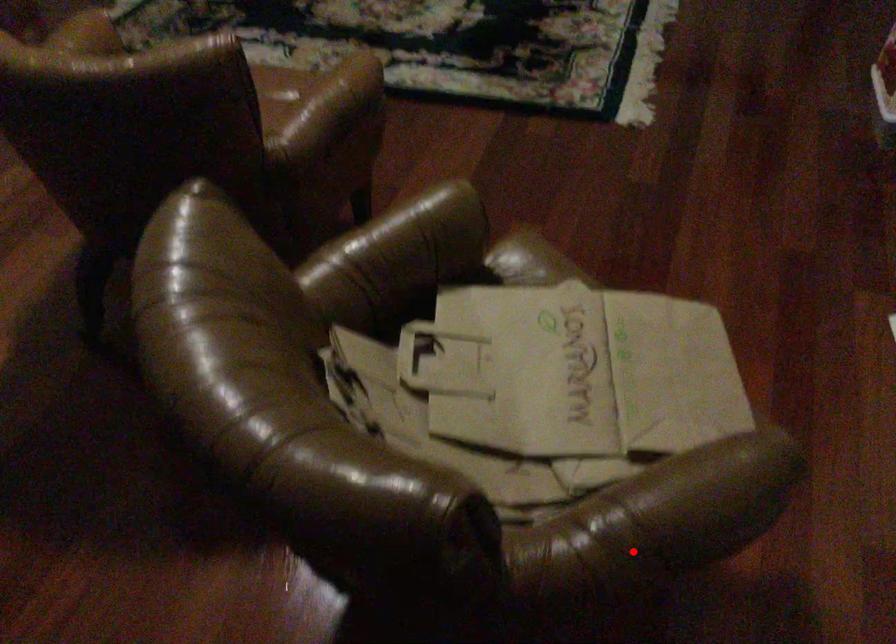
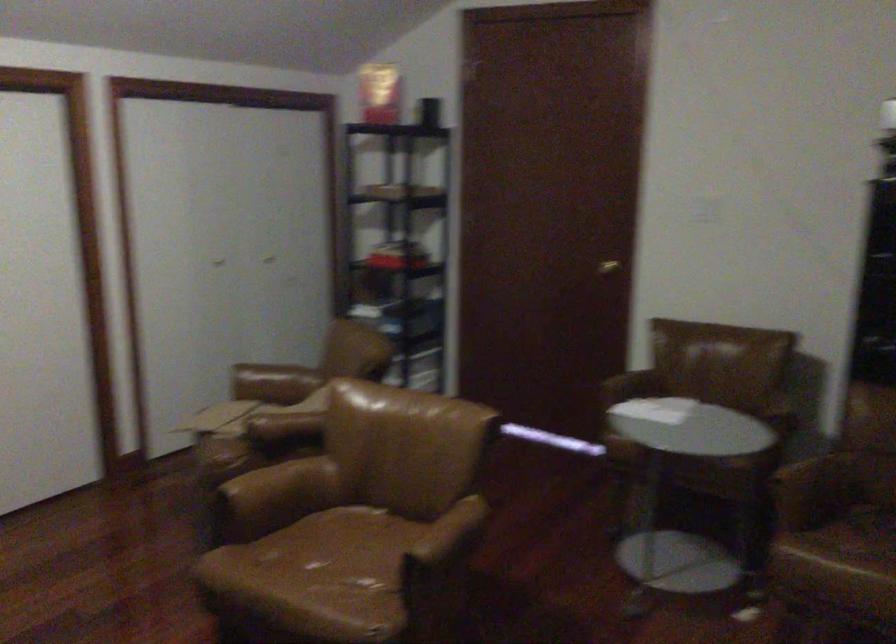
Question: I am providing you with two images of the same scene from different viewpoints. In image1, a red point is highlighted. Considering the same 3D point in image2, which of the following is correct?

Choices:
 (A) It is closer
 (B) It is farther

Answer: (B)